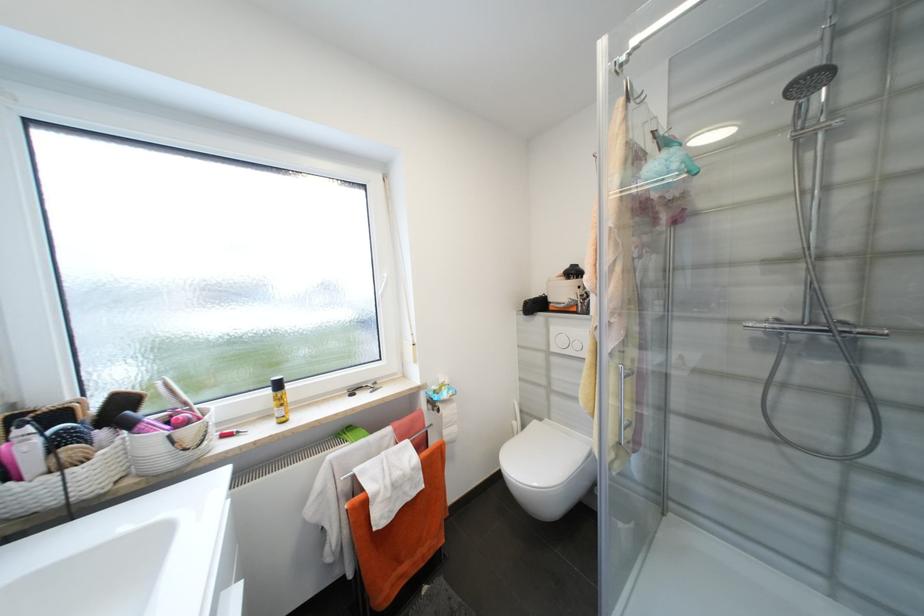
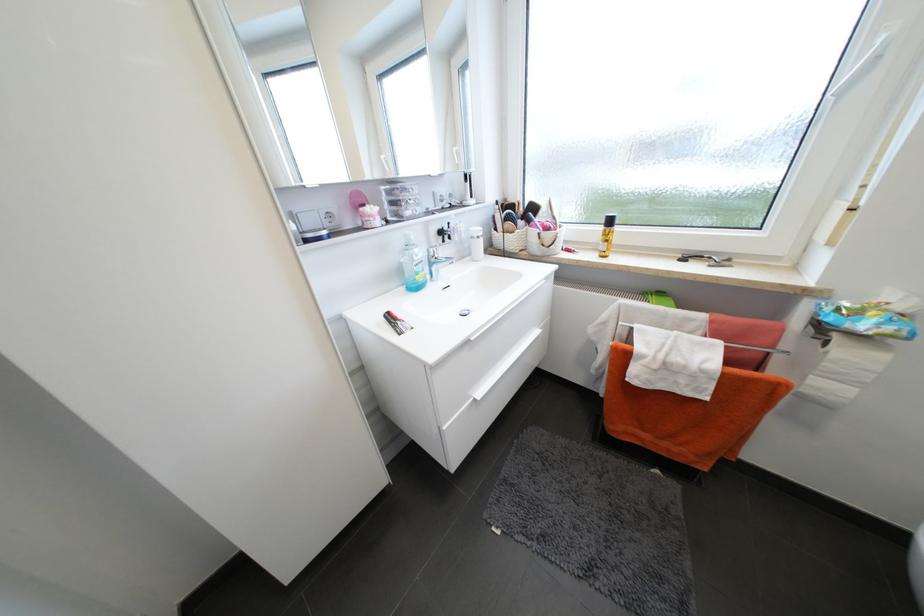
Locate, in the second image, the point that corresponds to [175,438] in the first image.

(544, 235)